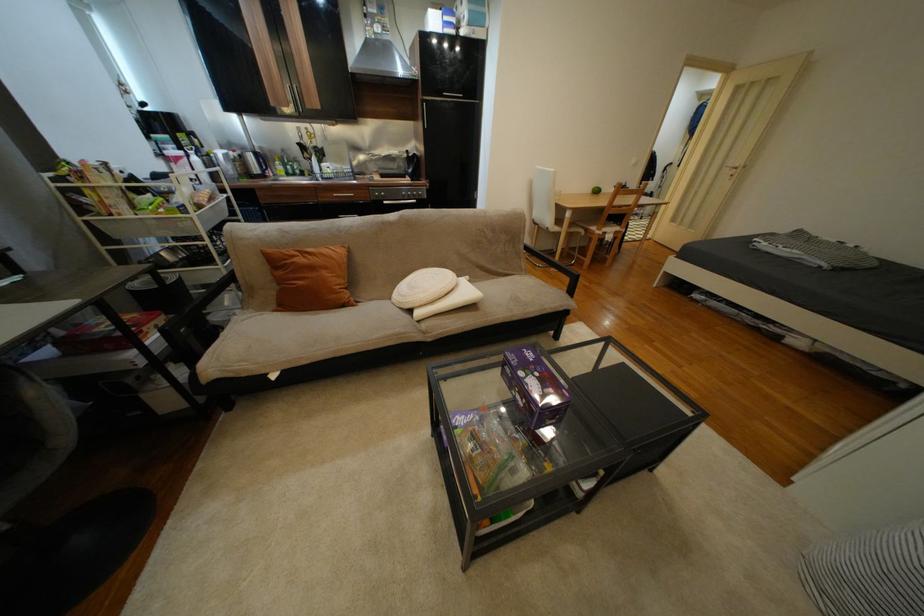
Identify the location of black sofa armrest. The width and height of the screenshot is (924, 616). (554, 268).